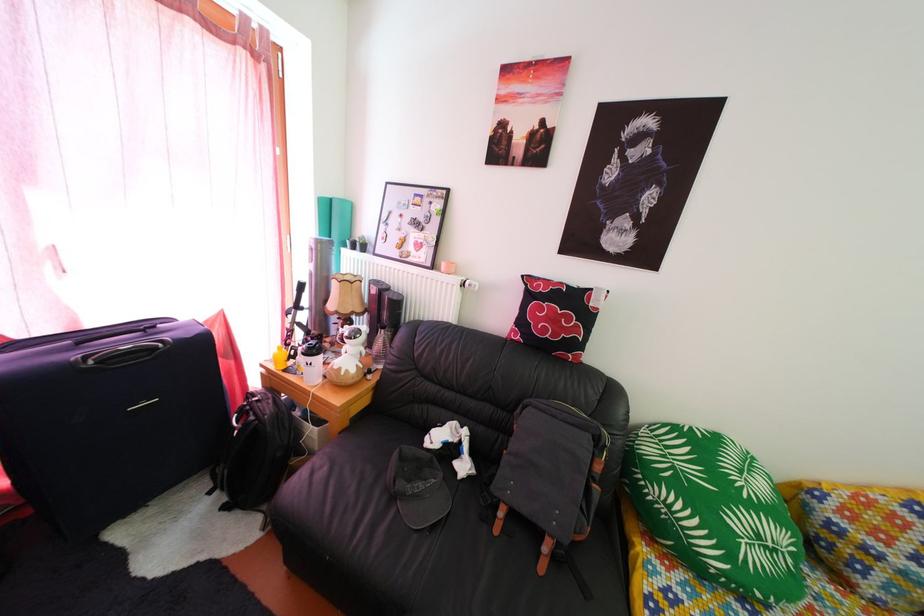
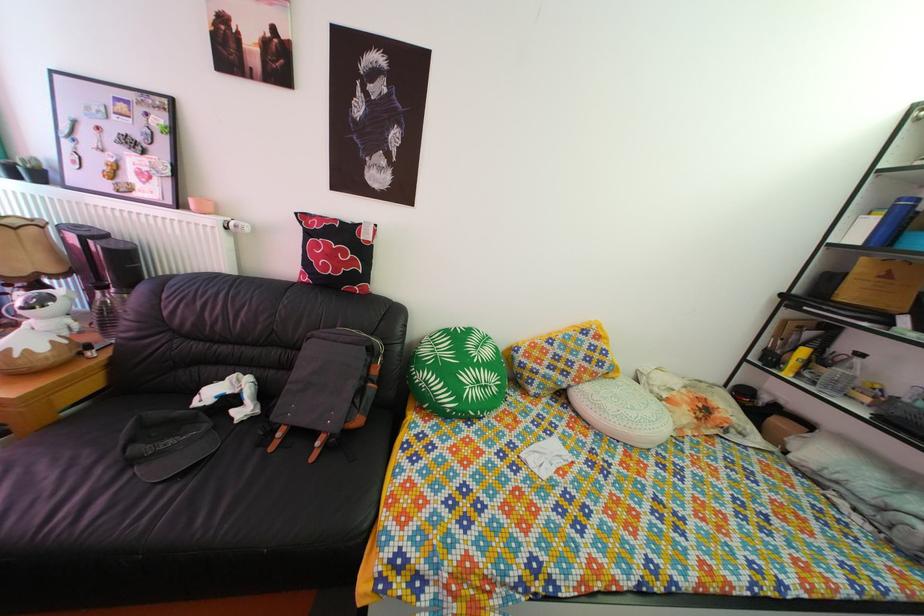
The point at (x=562, y=328) is marked in the first image. Where is the corresponding point in the second image?

(338, 264)